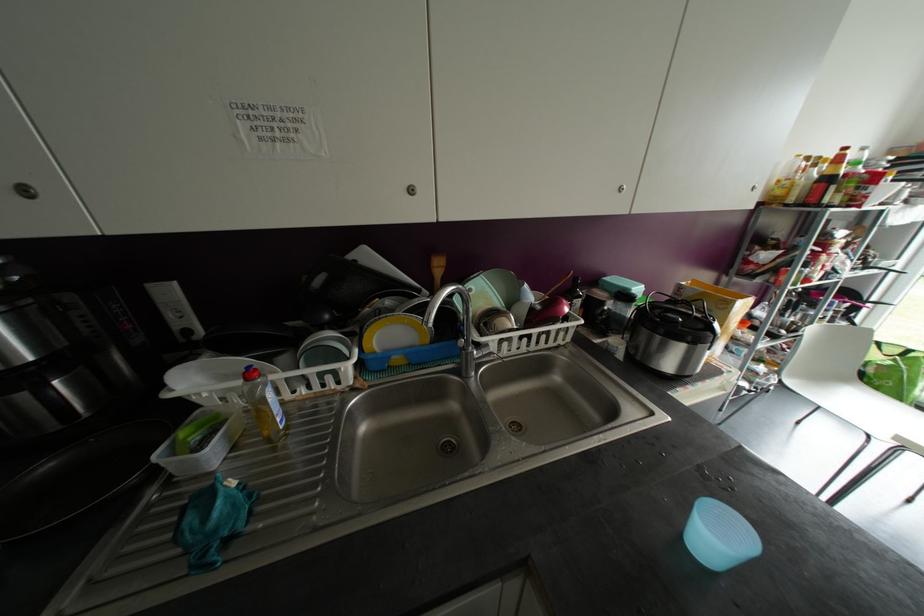
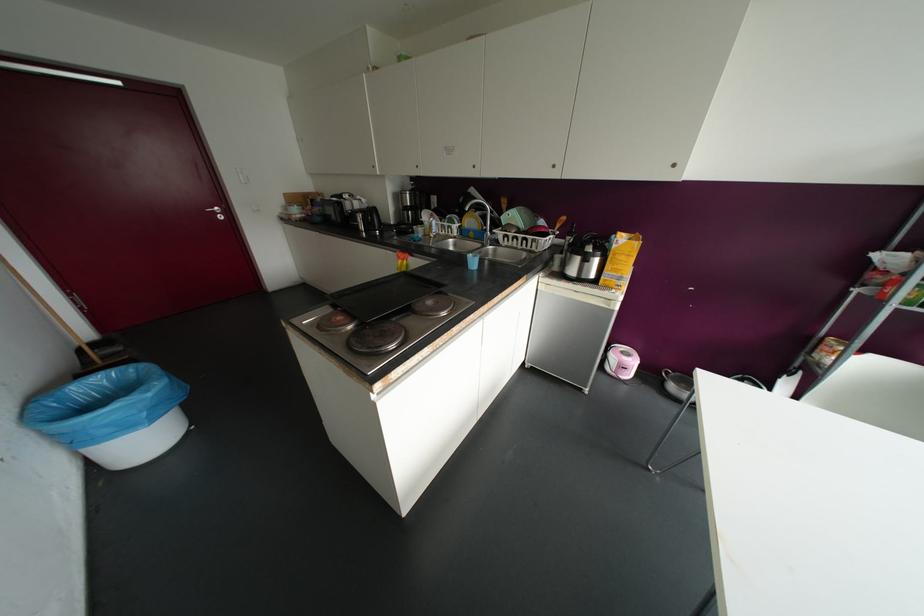
Where in the second image is the point corresponding to point (410, 190) from the first image?

(473, 166)